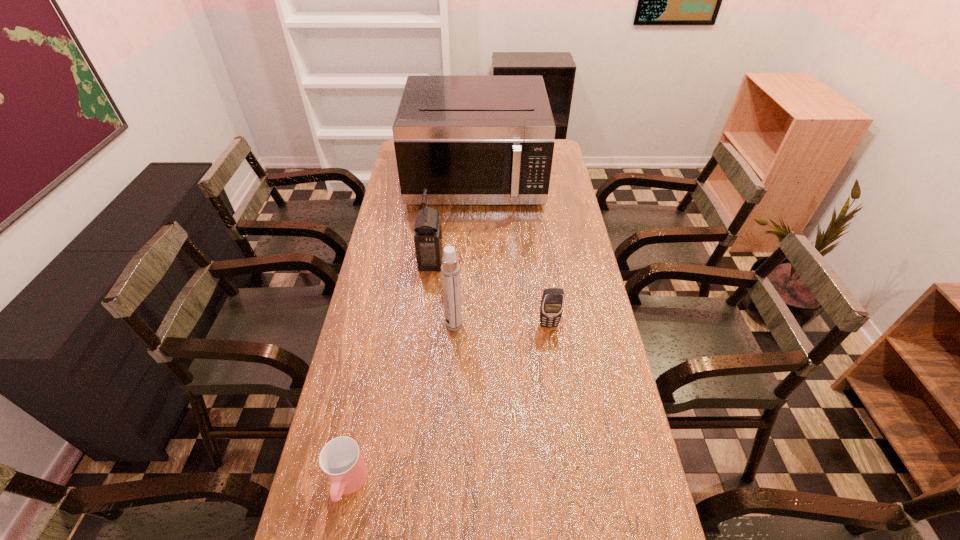
At what (x,y) coordinates should I click in order to perform the action: click on free space that is in between the cellular telephone and the aerosol can. Please return your answer as a coordinate pair (x, y). The width and height of the screenshot is (960, 540). Looking at the image, I should click on (501, 325).

Image resolution: width=960 pixels, height=540 pixels. In order to click on vacant region between the aerosol can and the cellular telephone in this screenshot , I will do `click(501, 325)`.

Where is `free spot between the lantern and the aerosol can`? This screenshot has width=960, height=540. free spot between the lantern and the aerosol can is located at coordinates 443,293.

At what (x,y) coordinates should I click in order to perform the action: click on free space that is in between the microwave_oven and the fourth nearest object. Please return your answer as a coordinate pair (x, y). Looking at the image, I should click on (453, 221).

Locate an element on the screen. The image size is (960, 540). vacant point located between the cellular telephone and the nearest object is located at coordinates (448, 404).

Find the location of a particular element. vacant region between the lantern and the shortest object is located at coordinates (390, 373).

At what (x,y) coordinates should I click in order to perform the action: click on empty location between the fourth tallest object and the microwave_oven. Please return your answer as a coordinate pair (x, y). The height and width of the screenshot is (540, 960). Looking at the image, I should click on 512,253.

Identify which object is located as the third nearest to the nearest object. Please provide its 2D coordinates. Your answer should be formatted as a tuple, i.e. [(x, y)], where the tuple contains the x and y coordinates of a point satisfying the conditions above.

[(428, 234)]

Locate which object ranks in proximity to the lantern. Please provide its 2D coordinates. Your answer should be formatted as a tuple, i.e. [(x, y)], where the tuple contains the x and y coordinates of a point satisfying the conditions above.

[(469, 140)]

Find the location of a particular element. free location that satisfies the following two spatial constraints: 1. on the front-facing side of the fourth nearest object; 2. on the back side of the aerosol can is located at coordinates (423, 325).